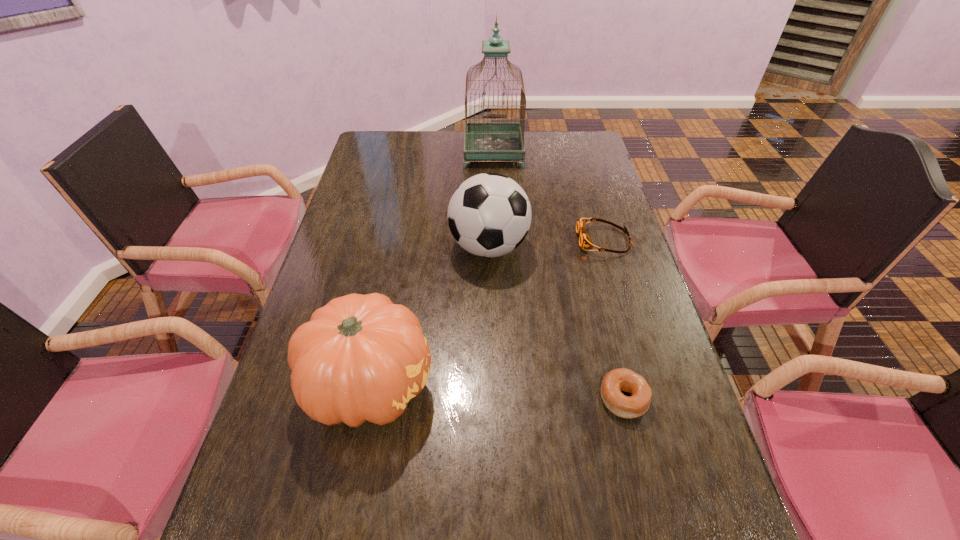
Locate an element on the screen. The image size is (960, 540). blank area located 0.310m with the lenses facing forward on the goggles is located at coordinates (475, 240).

At what (x,y) coordinates should I click in order to perform the action: click on free spot located 0.330m with the lenses facing forward on the goggles. Please return your answer as a coordinate pair (x, y). This screenshot has height=540, width=960. Looking at the image, I should click on (468, 240).

Find the location of a particular element. The image size is (960, 540). vacant space located with the lenses facing forward on the goggles is located at coordinates point(468,240).

Where is `object at the far edge`? object at the far edge is located at coordinates (483, 140).

The width and height of the screenshot is (960, 540). What are the coordinates of `object positioned at the left edge` in the screenshot? It's located at click(360, 357).

Locate an element on the screen. bagel located at the right edge is located at coordinates (622, 379).

Where is `goggles that is at the right edge`? The width and height of the screenshot is (960, 540). goggles that is at the right edge is located at coordinates (585, 241).

In the image, there is a desktop. Where is `free region at the far edge`? free region at the far edge is located at coordinates (431, 153).

Find the location of `free space at the left edge of the desktop`. free space at the left edge of the desktop is located at coordinates (381, 173).

Where is `vacant space at the right edge of the desktop`? Image resolution: width=960 pixels, height=540 pixels. vacant space at the right edge of the desktop is located at coordinates (582, 259).